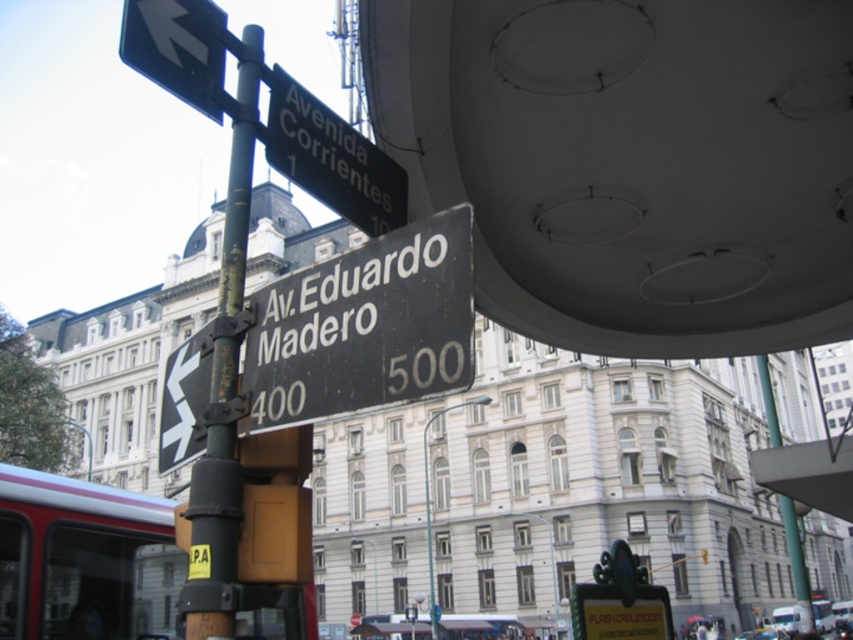
Question: Is black matte street sign at center positioned behind rusty metal pole at upper left?

Choices:
 (A) yes
 (B) no

Answer: (B)

Question: Considering the relative positions of black plastic street sign at upper center and green metallic pole at upper center in the image provided, where is black plastic street sign at upper center located with respect to green metallic pole at upper center?

Choices:
 (A) left
 (B) right

Answer: (A)

Question: Which of the following is the farthest from the observer?

Choices:
 (A) black plastic arrow at upper left
 (B) green metallic pole at upper center
 (C) rusty metal pole at upper left

Answer: (B)

Question: Is black plastic street sign at upper center to the right of black plastic arrow at upper left from the viewer's perspective?

Choices:
 (A) yes
 (B) no

Answer: (A)

Question: Which point is closer to the camera?

Choices:
 (A) black matte street sign at center
 (B) rusty metal pole at upper left

Answer: (A)

Question: Which object is the farthest from the green metallic pole at upper center?

Choices:
 (A) black plastic street sign at upper center
 (B) black plastic arrow at upper left
 (C) black matte street sign at center

Answer: (B)